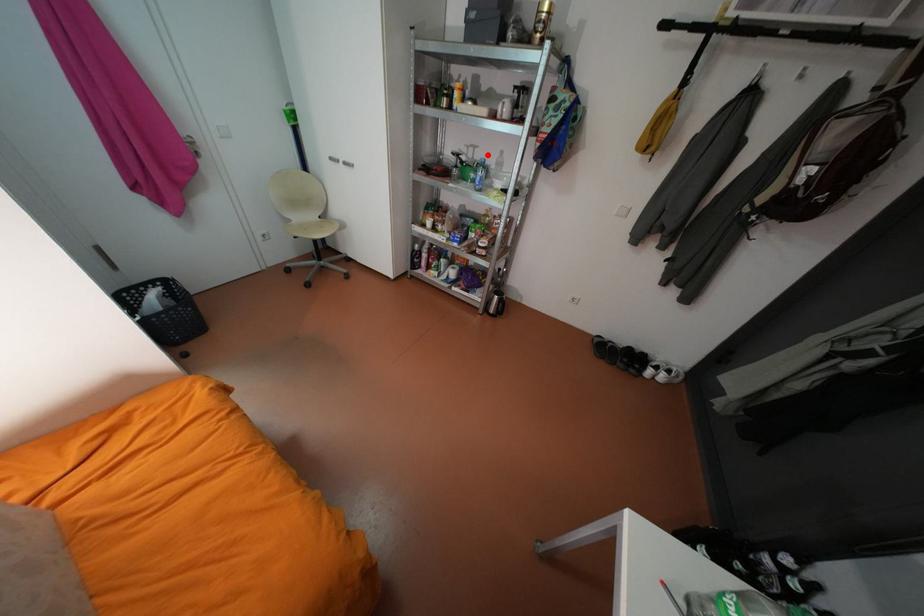
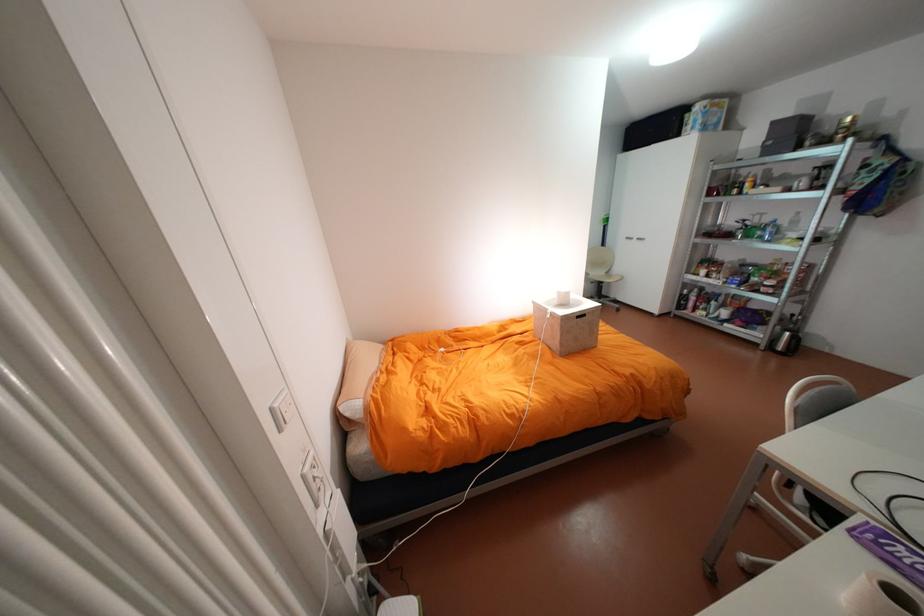
Find the pixel in the second image that matches the highlighted location in the first image.

(775, 219)